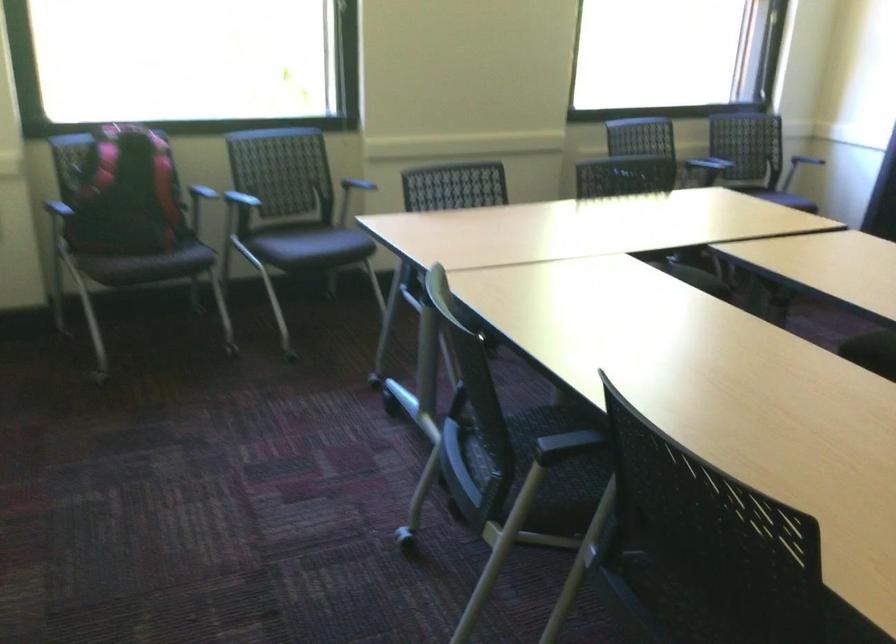
Which object does [125,194] point to?

This point indicates the red and black backpack.